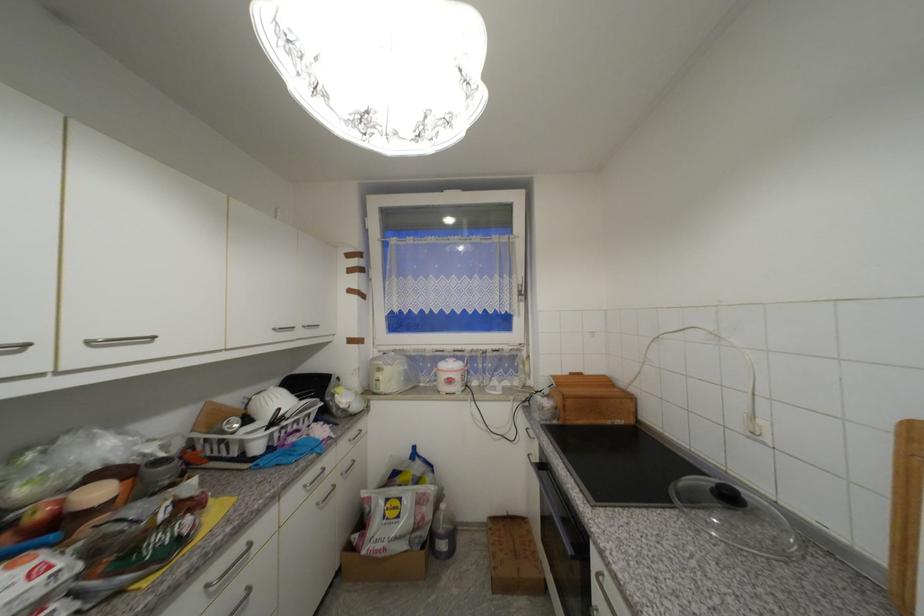
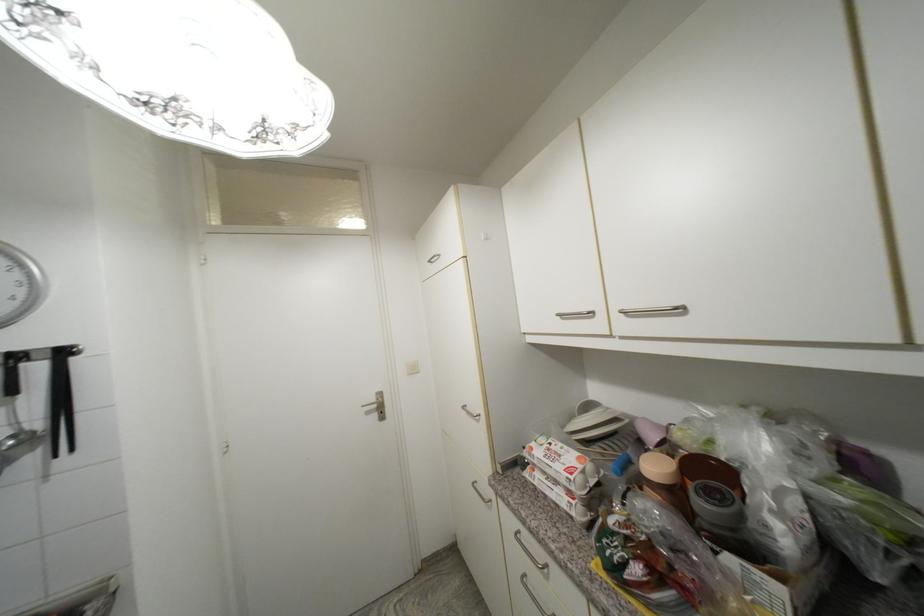
Find the pixel in the second image that matches (70,440) in the first image.

(730, 410)